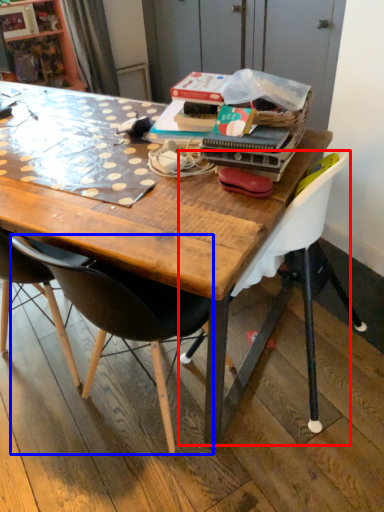
Question: Which point is further to the camera, chair (highlighted by a red box) or chair (highlighted by a blue box)?

Choices:
 (A) chair
 (B) chair

Answer: (A)